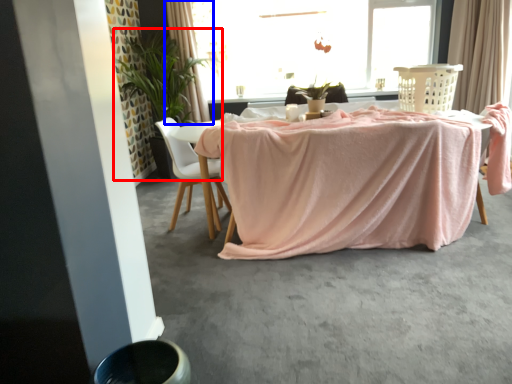
Question: Among these objects, which one is farthest to the camera, houseplant (highlighted by a red box) or curtain (highlighted by a blue box)?

Choices:
 (A) houseplant
 (B) curtain

Answer: (B)